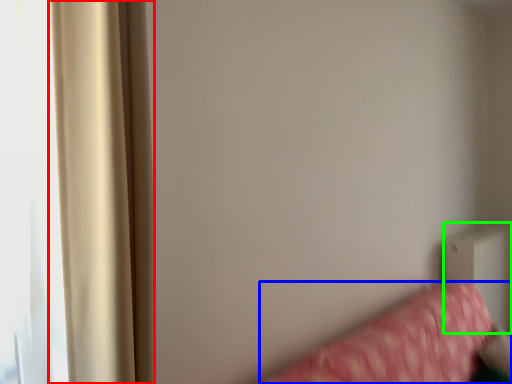
Question: Which is nearer to the curtain (highlighted by a red box)? furniture (highlighted by a blue box) or radiator (highlighted by a green box).

Choices:
 (A) furniture
 (B) radiator

Answer: (A)